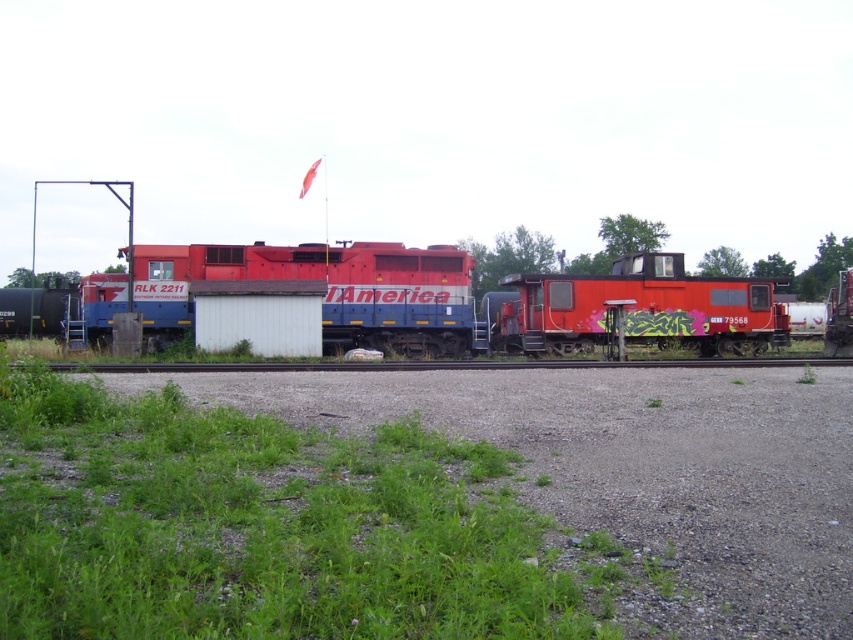
You are a photographer planning to take a photo of the matte red train at center and the black asphalt train track at center. Which object should you focus on first if you want to capture both in a single frame without moving the camera?

The matte red train at center is larger in size than the black asphalt train track at center, so you should focus on the matte red train at center first to ensure it is sharp and centered in the frame before adjusting for the track.

You are a railway inspector checking the alignment of two trains in the yard. The scene shows a matte red train at center and a shiny red train car at center. Which one is bigger in size?

The matte red train at center has a larger size compared to the shiny red train car at center.

You are a railway engineer inspecting the tracks in the gravel area. You notice a point marked at coordinates (421,300). What object is located at that point?

The point at coordinates (421,300) is occupied by the matte red train at center.